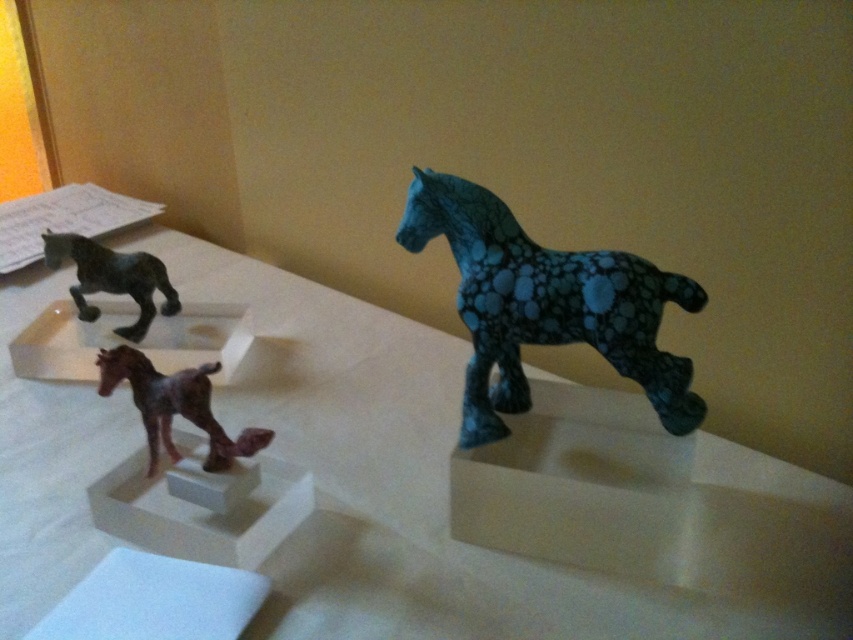
Question: Which point is farther to the camera?

Choices:
 (A) blue textured horse at center
 (B) white plastic table at center
 (C) brown matte horse at lower left

Answer: (C)

Question: Is blue textured horse at center to the right of matte black horse at left from the viewer's perspective?

Choices:
 (A) no
 (B) yes

Answer: (B)

Question: Is blue textured horse at center closer to camera compared to matte black horse at left?

Choices:
 (A) yes
 (B) no

Answer: (A)

Question: Estimate the real-world distances between objects in this image. Which object is closer to the brown matte horse at lower left?

Choices:
 (A) matte black horse at left
 (B) blue textured horse at center
 (C) white plastic table at center

Answer: (C)

Question: Which object appears farthest from the camera in this image?

Choices:
 (A) matte black horse at left
 (B) brown matte horse at lower left

Answer: (A)

Question: Is blue textured horse at center above matte black horse at left?

Choices:
 (A) no
 (B) yes

Answer: (A)